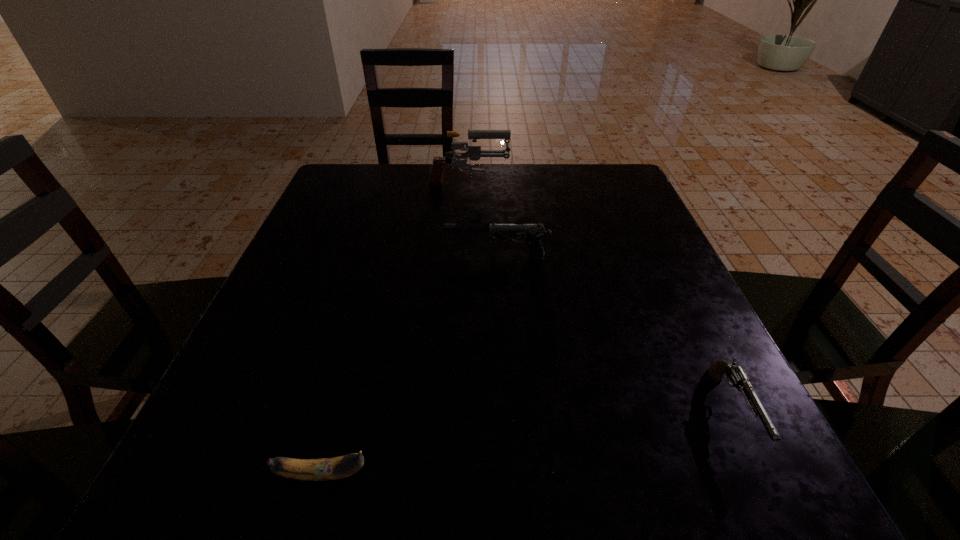
Locate an element on the screen. This screenshot has height=540, width=960. vacant space situated 0.260m at the muzzle end of the second tallest object is located at coordinates (321, 256).

You are a GUI agent. You are given a task and a screenshot of the screen. Output one action in this format:
    pyautogui.click(x=<x>, y=<y>)
    Task: Click on the free space located at the muzzle end of the second tallest object
    The width and height of the screenshot is (960, 540).
    Given the screenshot: What is the action you would take?
    pyautogui.click(x=325, y=256)

Locate an element on the screen. The height and width of the screenshot is (540, 960). free location located on the peel of the nearest object is located at coordinates (456, 474).

You are a GUI agent. You are given a task and a screenshot of the screen. Output one action in this format:
    pyautogui.click(x=<x>, y=<y>)
    Task: Click on the object positioned at the far edge
    The image size is (960, 540).
    Given the screenshot: What is the action you would take?
    pyautogui.click(x=474, y=153)

Find the location of `banana that is positioned at the near edge`. banana that is positioned at the near edge is located at coordinates (340, 467).

Where is `gun situated at the near edge`? Image resolution: width=960 pixels, height=540 pixels. gun situated at the near edge is located at coordinates (735, 373).

Find the location of a particular element. Image resolution: width=960 pixels, height=540 pixels. object present at the left edge is located at coordinates (340, 467).

Where is `object located in the right edge section of the desktop`? This screenshot has height=540, width=960. object located in the right edge section of the desktop is located at coordinates click(735, 373).

Find the location of `object at the near left corner`. object at the near left corner is located at coordinates (340, 467).

The image size is (960, 540). Identify the location of object that is at the near right corner. (735, 373).